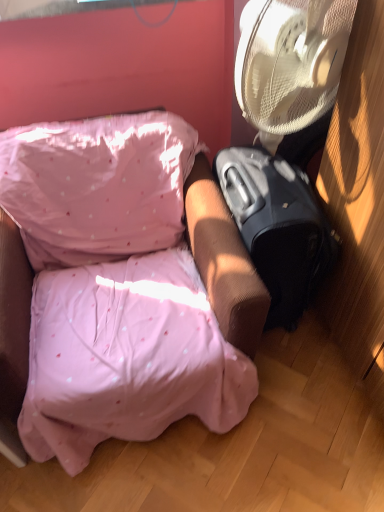
Question: From a real-world perspective, is black matte suitcase at right over pink fabric couch at center?

Choices:
 (A) no
 (B) yes

Answer: (A)

Question: Is the depth of black matte suitcase at right less than that of pink fabric couch at center?

Choices:
 (A) yes
 (B) no

Answer: (B)

Question: Is black matte suitcase at right bigger than pink fabric couch at center?

Choices:
 (A) yes
 (B) no

Answer: (B)

Question: Considering the relative sizes of black matte suitcase at right and pink fabric couch at center in the image provided, is black matte suitcase at right smaller than pink fabric couch at center?

Choices:
 (A) no
 (B) yes

Answer: (B)

Question: Is black matte suitcase at right not close to pink fabric couch at center?

Choices:
 (A) no
 (B) yes

Answer: (A)

Question: Is black matte suitcase at right facing away from pink fabric couch at center?

Choices:
 (A) no
 (B) yes

Answer: (B)

Question: Can you confirm if pink fabric couch at center is smaller than black matte suitcase at right?

Choices:
 (A) no
 (B) yes

Answer: (A)

Question: Is pink fabric couch at center far from black matte suitcase at right?

Choices:
 (A) no
 (B) yes

Answer: (A)

Question: From a real-world perspective, is pink fabric couch at center on black matte suitcase at right?

Choices:
 (A) yes
 (B) no

Answer: (A)

Question: Is black matte suitcase at right a part of pink fabric couch at center?

Choices:
 (A) no
 (B) yes

Answer: (A)

Question: Is pink fabric couch at center wider than black matte suitcase at right?

Choices:
 (A) yes
 (B) no

Answer: (A)

Question: Does pink fabric couch at center turn towards black matte suitcase at right?

Choices:
 (A) no
 (B) yes

Answer: (A)

Question: Based on their sizes in the image, would you say pink fabric couch at center is bigger or smaller than black matte suitcase at right?

Choices:
 (A) small
 (B) big

Answer: (B)